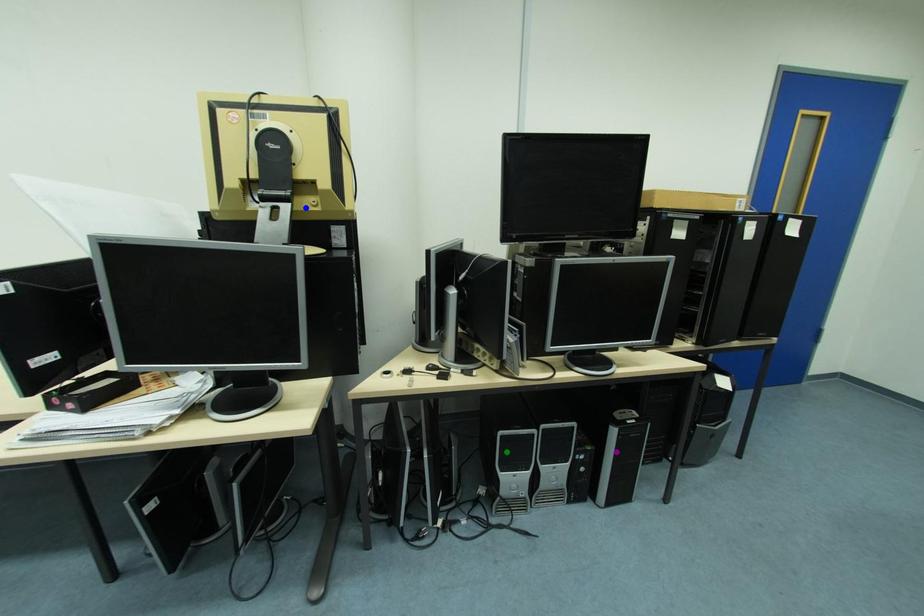
Order these from farthest to nearest:
blue point | purple point | green point

purple point
green point
blue point